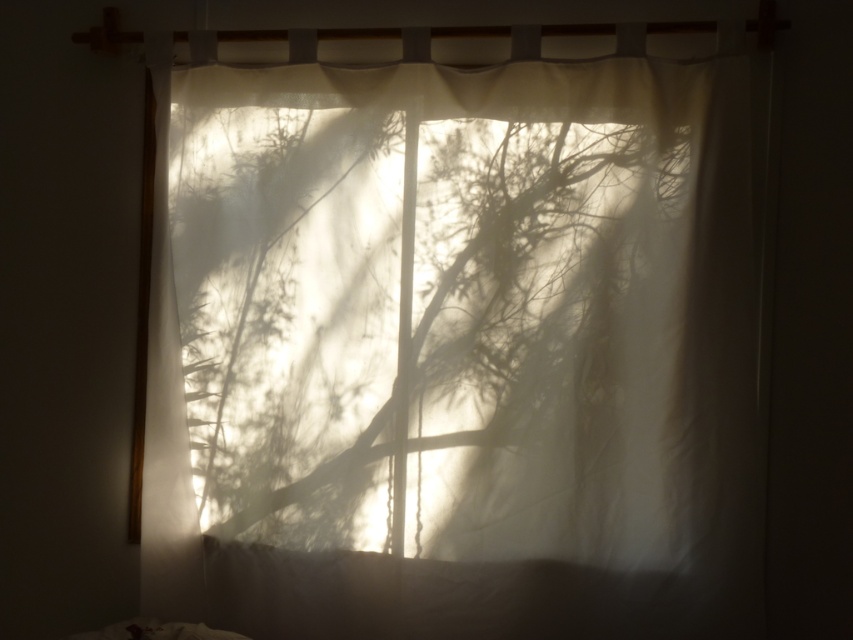
Can you confirm if translucent white curtain at center is thinner than white soft pillow at lower center?

Incorrect, translucent white curtain at center's width is not less than white soft pillow at lower center's.

Does translucent white curtain at center appear over white soft pillow at lower center?

Yes.

Describe the element at coordinates (454, 333) in the screenshot. This screenshot has width=853, height=640. I see `translucent white curtain at center` at that location.

Where is `translucent white curtain at center`? Image resolution: width=853 pixels, height=640 pixels. translucent white curtain at center is located at coordinates (454, 333).